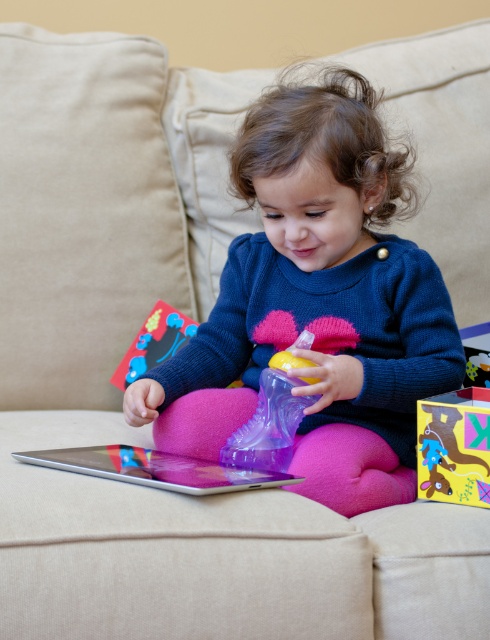
Question: Is matte cardboard box at center closer to the viewer compared to silver metallic tablet at lower center?

Choices:
 (A) yes
 (B) no

Answer: (B)

Question: Is transparent plastic sippy cup at center to the left of matte plastic toy at center from the viewer's perspective?

Choices:
 (A) yes
 (B) no

Answer: (B)

Question: Which object is closer to the camera taking this photo?

Choices:
 (A) silver metallic tablet at lower center
 (B) matte plastic toy at center
 (C) transparent plastic sippy cup at center
 (D) matte cardboard box at center

Answer: (A)

Question: Which object is positioned closest to the transparent plastic sippy cup at center?

Choices:
 (A) matte cardboard box at center
 (B) matte plastic toy at center
 (C) silver metallic tablet at lower center

Answer: (C)

Question: Can you confirm if transparent plastic sippy cup at center is positioned above matte plastic toy at center?

Choices:
 (A) yes
 (B) no

Answer: (B)

Question: Which point is closer to the camera taking this photo?

Choices:
 (A) (426, 484)
 (B) (156, 301)
 (C) (185, 458)

Answer: (A)